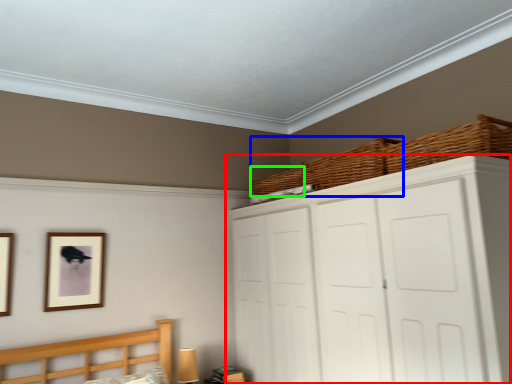
Question: Considering the real-world distances, which object is farthest from cupboard (highlighted by a red box)? basket (highlighted by a blue box) or basket (highlighted by a green box)?

Choices:
 (A) basket
 (B) basket

Answer: (B)